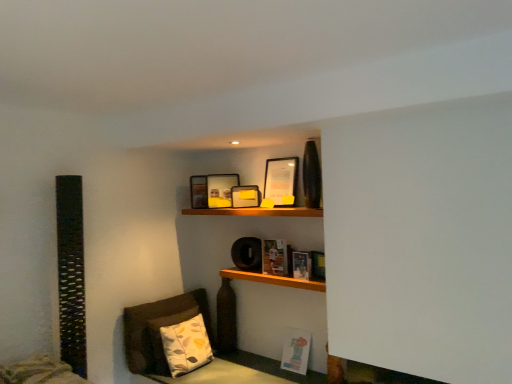
Where is `free location above matte paper book at lower right, the 1th book when ordered from bottom to top (from a real-world perspective)`? The width and height of the screenshot is (512, 384). free location above matte paper book at lower right, the 1th book when ordered from bottom to top (from a real-world perspective) is located at coordinates (301, 324).